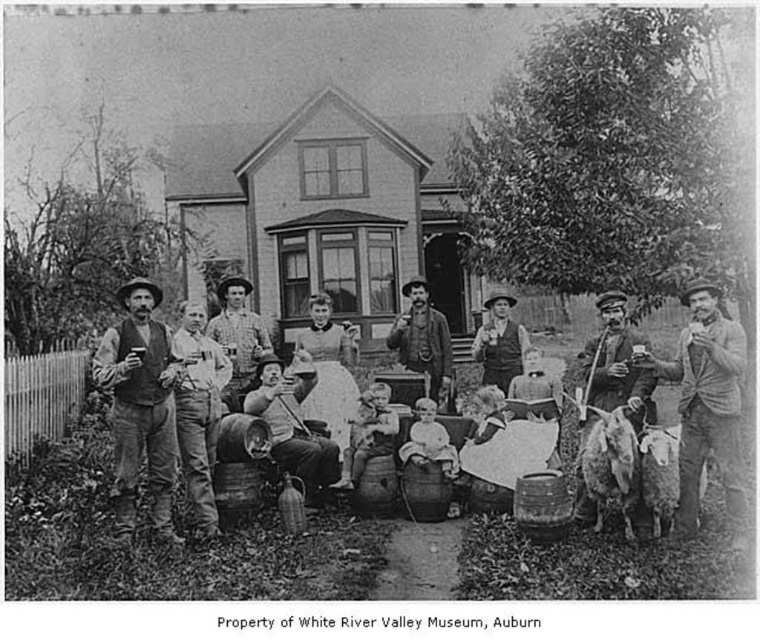
Consider the image. Does rough wooden barrel at center have a larger size compared to smooth white baby at center?

No, rough wooden barrel at center is not bigger than smooth white baby at center.

At what (x,y) coordinates should I click in order to perform the action: click on rough wooden barrel at center. Please return your answer as a coordinate pair (x, y). The height and width of the screenshot is (640, 760). Looking at the image, I should click on (238, 337).

Find the location of `rough wooden barrel at center`. rough wooden barrel at center is located at coordinates (238, 337).

Does smooth leather jacket at right appear on the left side of rugged leather jacket at center?

Incorrect, smooth leather jacket at right is not on the left side of rugged leather jacket at center.

Who is shorter, smooth leather jacket at right or rugged leather jacket at center?

rugged leather jacket at center

Does point (705, 307) lie in front of point (397, 346)?

Yes, point (705, 307) is in front of point (397, 346).

This screenshot has height=640, width=760. What are the coordinates of `smooth leather jacket at right` in the screenshot? It's located at (705, 404).

Consider the image. Measure the distance between point (733,513) and camera.

Point (733,513) is 7.07 meters from camera.

This screenshot has width=760, height=640. Describe the element at coordinates (717, 461) in the screenshot. I see `rustic wooden barrel at center` at that location.

The width and height of the screenshot is (760, 640). Find the location of `rustic wooden barrel at center`. rustic wooden barrel at center is located at coordinates (717, 461).